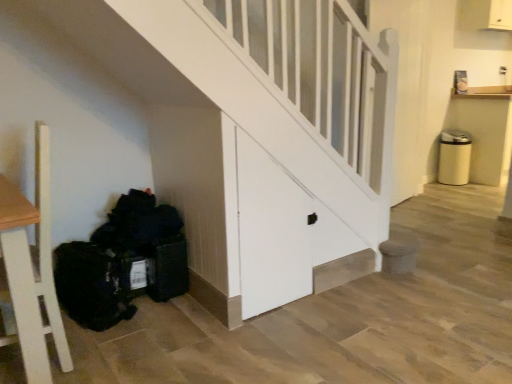
Image resolution: width=512 pixels, height=384 pixels. Find the location of `blank space situated above white wood door at center (from a real-world perspective)`. blank space situated above white wood door at center (from a real-world perspective) is located at coordinates (272, 109).